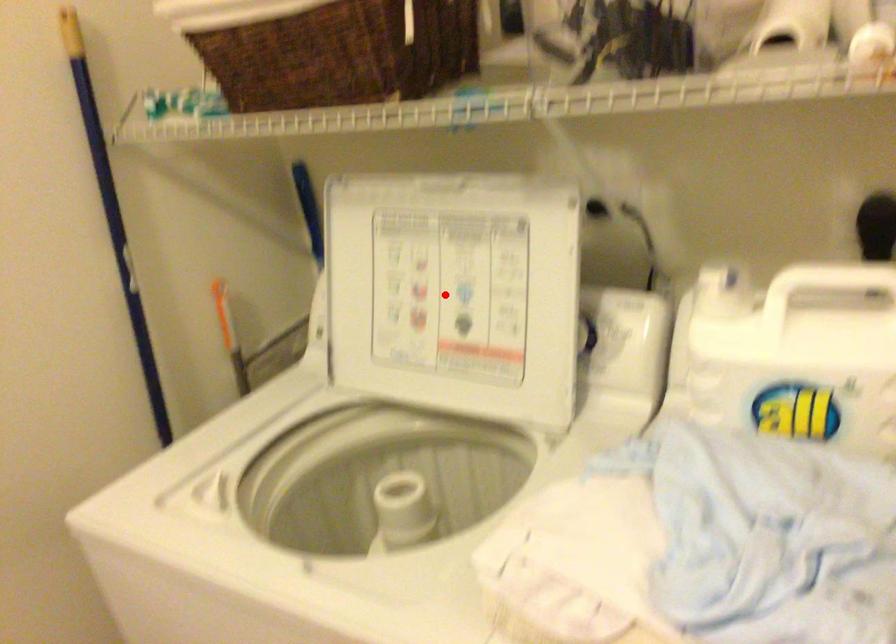
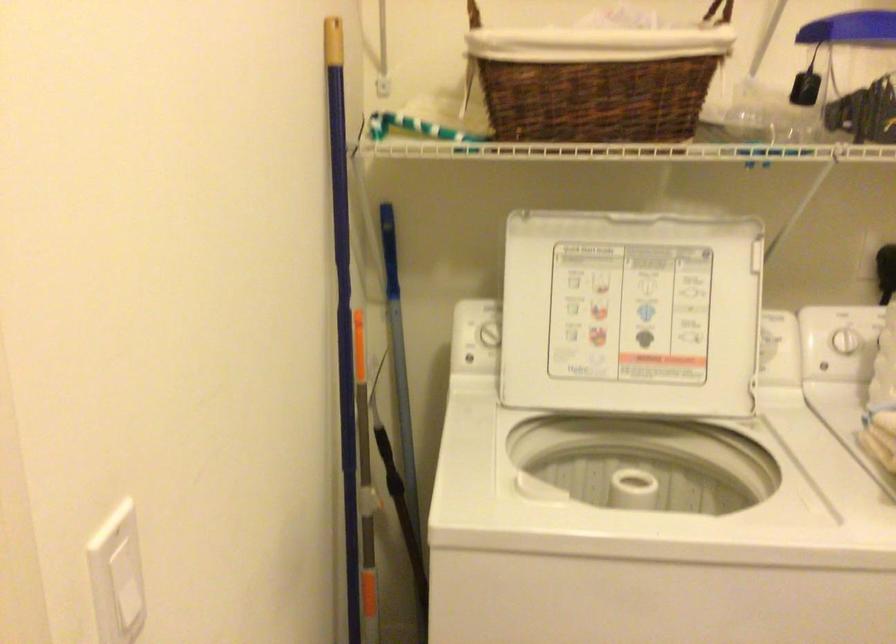
Where in the second image is the point corresponding to the highlighted location from the first image?

(631, 313)